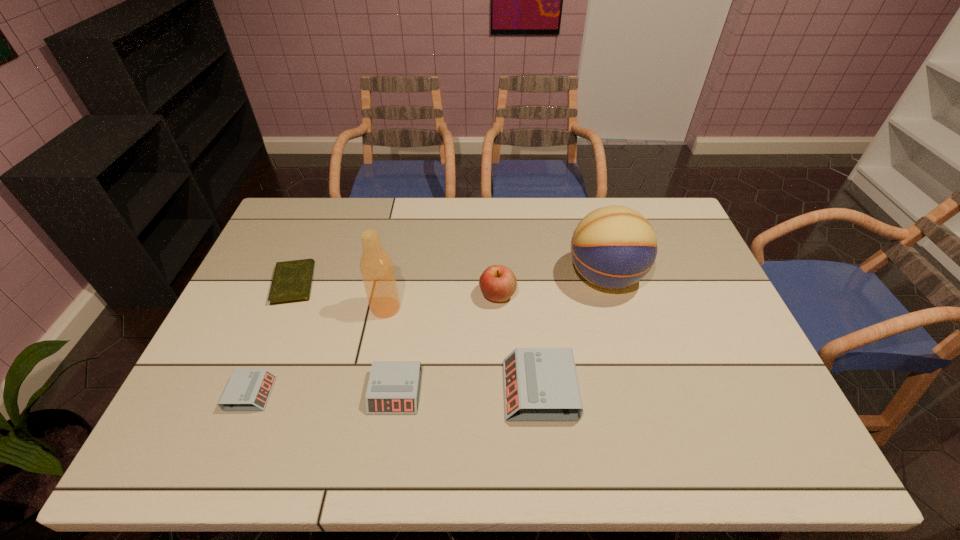
Locate an element on the screen. The height and width of the screenshot is (540, 960). vacant area that lies between the diary and the sixth tallest object is located at coordinates (273, 339).

Where is `blank region between the beer bottle and the fourth shortest object`? The height and width of the screenshot is (540, 960). blank region between the beer bottle and the fourth shortest object is located at coordinates (463, 349).

This screenshot has height=540, width=960. I want to click on vacant space that's between the rightmost object and the second shortest alarm clock, so click(500, 334).

Identify the location of empty location between the rightmost object and the fourth shortest object. This screenshot has width=960, height=540. (572, 333).

What are the coordinates of `free space between the basketball and the rightmost alarm clock` in the screenshot? It's located at (572, 333).

At what (x,y) coordinates should I click in order to perform the action: click on vacant space in between the diary and the rightmost object. Please return your answer as a coordinate pair (x, y). Looking at the image, I should click on (449, 280).

Where is `blank region between the beer bottle and the tallest alarm clock`? The width and height of the screenshot is (960, 540). blank region between the beer bottle and the tallest alarm clock is located at coordinates (463, 349).

Identify the location of the second closest object relative to the third shortest object. Image resolution: width=960 pixels, height=540 pixels. (541, 384).

Locate which object ranks fourth in proximity to the fifth tallest object. Please provide its 2D coordinates. Your answer should be formatted as a tuple, i.e. [(x, y)], where the tuple contains the x and y coordinates of a point satisfying the conditions above.

[(498, 283)]

Identify which alarm clock is the second nearest to the rightmost alarm clock. Please provide its 2D coordinates. Your answer should be formatted as a tuple, i.e. [(x, y)], where the tuple contains the x and y coordinates of a point satisfying the conditions above.

[(247, 389)]